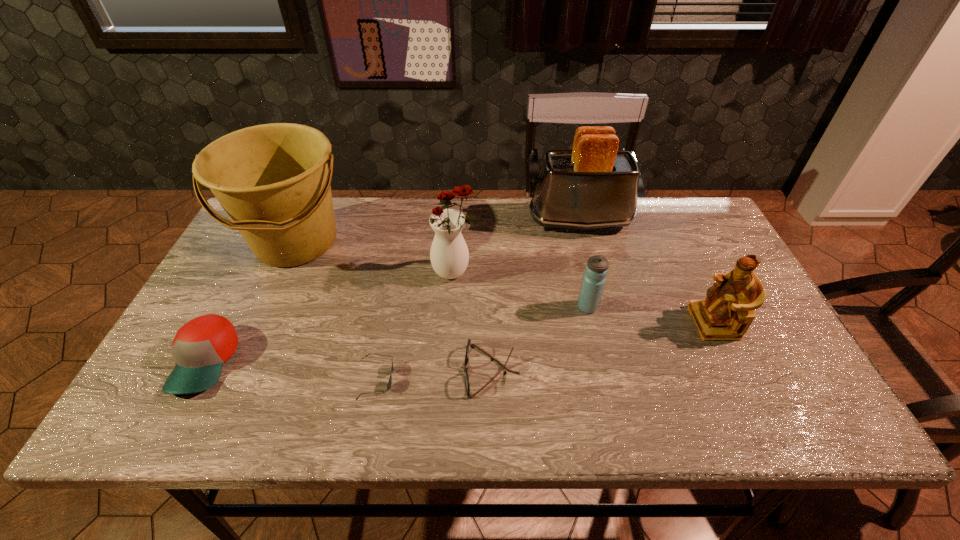
This screenshot has height=540, width=960. What are the coordinates of `vacant area situated on the front-facing side of the second shortest object` in the screenshot? It's located at (389, 371).

This screenshot has height=540, width=960. In order to click on free space located on the front-facing side of the second shortest object in this screenshot , I will do `click(442, 371)`.

You are a GUI agent. You are given a task and a screenshot of the screen. Output one action in this format:
    pyautogui.click(x=<x>, y=<y>)
    Task: Click on the free location located 0.230m on the lenses of the shortest object
    The height and width of the screenshot is (540, 960).
    Given the screenshot: What is the action you would take?
    point(495,378)

Locate an element on the screen. This screenshot has width=960, height=540. toaster at the far edge is located at coordinates (594, 186).

Locate an element on the screen. The image size is (960, 540). bucket situated at the far edge is located at coordinates (272, 180).

Find the location of a particular element. The image size is (960, 540). baseball cap that is at the near edge is located at coordinates (200, 347).

This screenshot has width=960, height=540. Identify the location of spectacles that is at the near edge. (467, 383).

Where is `sunglasses located in the near edge section of the desktop`? The width and height of the screenshot is (960, 540). sunglasses located in the near edge section of the desktop is located at coordinates coord(392,368).

Identify the location of bucket that is at the left edge. The image size is (960, 540). (272, 180).

The image size is (960, 540). I want to click on baseball cap at the left edge, so click(200, 347).